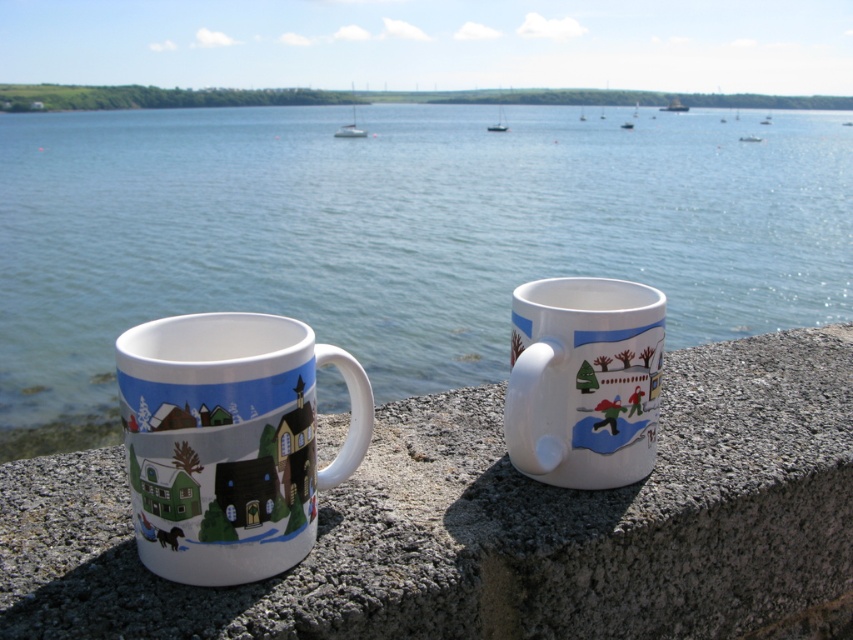
Question: Among these points, which one is farthest from the camera?

Choices:
 (A) (242, 481)
 (B) (358, 129)
 (C) (106, 499)

Answer: (B)

Question: In this image, where is white glossy sailboat at upper center located relative to white glossy sailboat at center?

Choices:
 (A) above
 (B) below

Answer: (B)

Question: Does white glossy sailboat at center have a smaller size compared to white plastic boat at center?

Choices:
 (A) yes
 (B) no

Answer: (B)

Question: Among these points, which one is farthest from the camera?

Choices:
 (A) (392, 573)
 (B) (677, 109)

Answer: (B)

Question: In this image, where is white glossy mug at right located relative to white plastic boat at center?

Choices:
 (A) right
 (B) left

Answer: (B)

Question: Among these objects, which one is nearest to the camera?

Choices:
 (A) blue water at center
 (B) white glossy mug at right
 (C) granite ledge at center

Answer: (C)